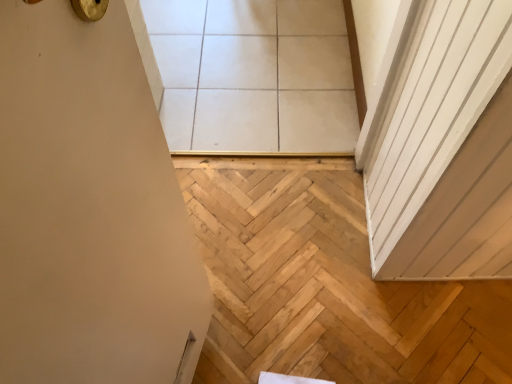
Locate an element on the screen. blank space situated above natural wood stairwell at lower right (from a real-world perspective) is located at coordinates [332, 295].